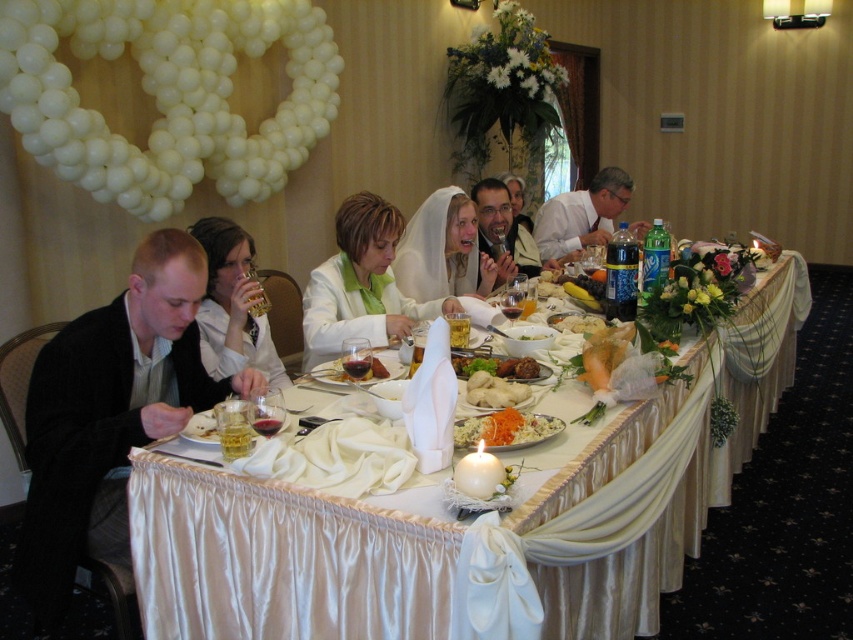
Question: Which of the following is the closest to the observer?

Choices:
 (A) matte black jacket at center
 (B) white fluffy bread at center
 (C) white satin dress at center

Answer: (B)

Question: Which point appears farthest from the camera in this image?

Choices:
 (A) (593, 321)
 (B) (310, 364)
 (C) (579, 225)
 (D) (627, 582)

Answer: (C)

Question: Is matte black jacket at center positioned before white fluffy bread at table center?

Choices:
 (A) no
 (B) yes

Answer: (A)

Question: Is matte white shirt at upper right further to camera compared to white glossy rice at center?

Choices:
 (A) no
 (B) yes

Answer: (B)

Question: Can you confirm if white satin dress at center is positioned to the left of matte white shirt at upper right?

Choices:
 (A) no
 (B) yes

Answer: (B)

Question: Which of these objects is positioned closest to the translucent glass wine at table center?

Choices:
 (A) white glossy rice at center
 (B) white fluffy bread at table center
 (C) white satin tablecloth at center

Answer: (A)